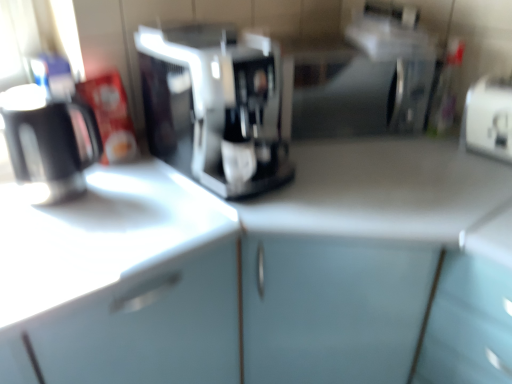
Question: Is white plastic toaster at right closer to camera compared to white glossy counter top at left?

Choices:
 (A) yes
 (B) no

Answer: (B)

Question: Is white plastic toaster at right smaller than white glossy counter top at left?

Choices:
 (A) yes
 (B) no

Answer: (A)

Question: Are white plastic toaster at right and white glossy counter top at left located far from each other?

Choices:
 (A) no
 (B) yes

Answer: (A)

Question: From the image's perspective, is white plastic toaster at right under white glossy counter top at left?

Choices:
 (A) yes
 (B) no

Answer: (B)

Question: Can you confirm if white plastic toaster at right is bigger than white glossy counter top at left?

Choices:
 (A) yes
 (B) no

Answer: (B)

Question: From the image's perspective, is matte black mug at left positioned above or below sleek silver coffee maker at center?

Choices:
 (A) below
 (B) above

Answer: (A)

Question: From their relative heights in the image, would you say matte black mug at left is taller or shorter than sleek silver coffee maker at center?

Choices:
 (A) short
 (B) tall

Answer: (A)

Question: In the image, is matte black mug at left positioned in front of or behind sleek silver coffee maker at center?

Choices:
 (A) front
 (B) behind

Answer: (B)

Question: Considering the positions of matte black mug at left and sleek silver coffee maker at center in the image, is matte black mug at left bigger or smaller than sleek silver coffee maker at center?

Choices:
 (A) big
 (B) small

Answer: (B)

Question: Looking at the image, does white plastic toaster at right seem bigger or smaller compared to sleek silver coffee maker at center?

Choices:
 (A) big
 (B) small

Answer: (B)

Question: From the image's perspective, relative to sleek silver coffee maker at center, is white plastic toaster at right above or below?

Choices:
 (A) below
 (B) above

Answer: (A)

Question: From a real-world perspective, is white plastic toaster at right physically located above or below sleek silver coffee maker at center?

Choices:
 (A) above
 (B) below

Answer: (B)

Question: Is white plastic toaster at right inside or outside of sleek silver coffee maker at center?

Choices:
 (A) inside
 (B) outside

Answer: (B)

Question: From a real-world perspective, is sleek silver coffee maker at center above or below white plastic toaster at right?

Choices:
 (A) above
 (B) below

Answer: (A)

Question: Considering the positions of sleek silver coffee maker at center and white plastic toaster at right in the image, is sleek silver coffee maker at center taller or shorter than white plastic toaster at right?

Choices:
 (A) short
 (B) tall

Answer: (B)